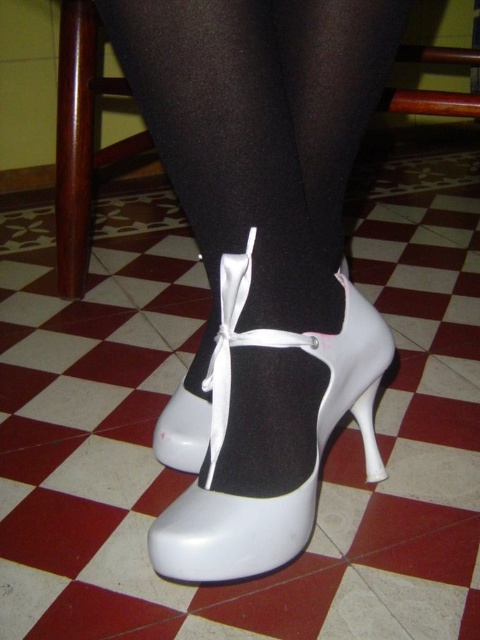
Question: Among these objects, which one is nearest to the camera?

Choices:
 (A) white satin shoe at center
 (B) white matte high-heeled shoe at center
 (C) white matte heel at lower center

Answer: (A)

Question: Does white satin shoe at center appear over white matte heel at lower center?

Choices:
 (A) yes
 (B) no

Answer: (A)

Question: Among these objects, which one is nearest to the camera?

Choices:
 (A) white matte high-heeled shoe at center
 (B) white matte heel at lower center
 (C) white satin shoe at center

Answer: (C)

Question: Which point is closer to the camera?

Choices:
 (A) (375, 348)
 (B) (199, 422)

Answer: (A)

Question: Does white satin shoe at center have a smaller size compared to white matte high-heeled shoe at center?

Choices:
 (A) no
 (B) yes

Answer: (A)

Question: Is white matte high-heeled shoe at center wider than white matte heel at lower center?

Choices:
 (A) no
 (B) yes

Answer: (B)